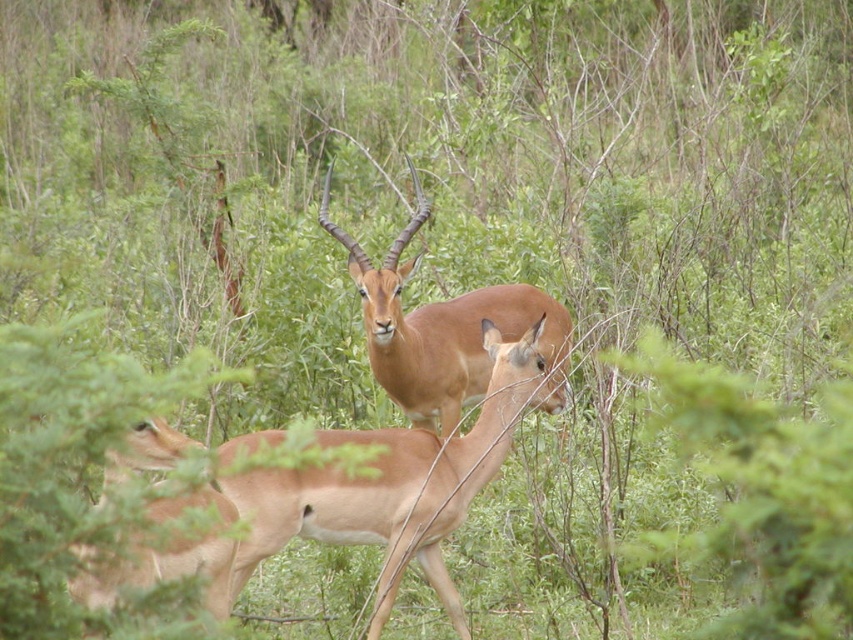
Question: Can you confirm if light brown fur at center is positioned below brown matte/deer at center?

Choices:
 (A) yes
 (B) no

Answer: (A)

Question: Which object is closer to the camera taking this photo?

Choices:
 (A) brown matte/deer at center
 (B) light brown fur antelope at center

Answer: (B)

Question: Which point is farther to the camera?

Choices:
 (A) light brown fur antelope at center
 (B) brown matte/deer at center

Answer: (B)

Question: Which of the following is the closest to the observer?

Choices:
 (A) (218, 540)
 (B) (254, 448)
 (C) (431, 387)

Answer: (A)

Question: Is light brown fur at center below brown matte/deer at center?

Choices:
 (A) yes
 (B) no

Answer: (A)

Question: Does light brown fur at center have a smaller size compared to light brown fur antelope at center?

Choices:
 (A) yes
 (B) no

Answer: (B)